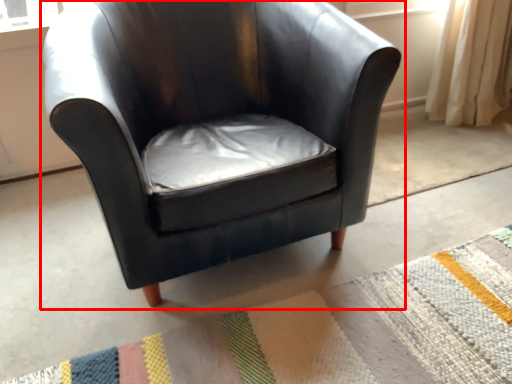
Question: From the image's perspective, considering the relative positions of chair (annotated by the red box) and mat in the image provided, where is chair (annotated by the red box) located with respect to the staircase?

Choices:
 (A) above
 (B) below

Answer: (A)